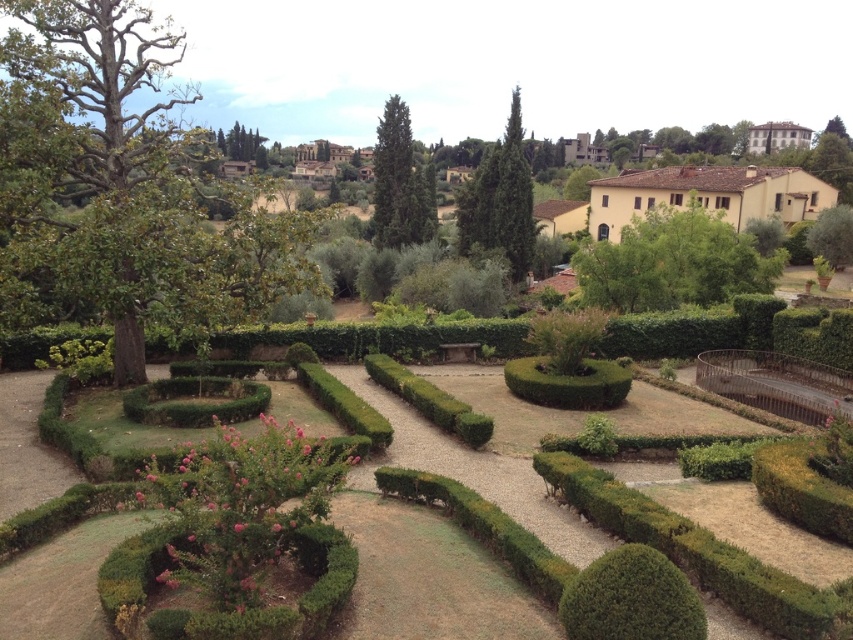
You are standing at the center of the garden and want to locate the green leafy tree at upper center. According to the garden layout, where should you look relative to your current position?

The green leafy tree at upper center is located at point 0.220 on the x axis and 0.797 on the y axis, so you should look to the left and slightly downward from your current position at the center of the garden.

You are a gardener planning to water the green leafy tree at upper center and the green leafy bush at right. Based on their positions, which one do you think is closer to the right edge of the garden?

The green leafy bush at right is closer to the right edge of the garden because the green leafy tree at upper center is positioned to the right of it, meaning the bush is further left compared to the tree.

Consider the image. You are standing at the entrance of the formal garden and want to reach the green leafy bush at lower right. The garden has a strict rule that you must stay on the pathways, which are the curved hedges. Given that the pathways are 3 feet wide, can you walk directly to the bush without stepping off the path?

The green leafy bush at lower right is 44.58 feet away from the camera. Since the pathways are 3 feet wide and you must stay on them, you can walk directly to the bush as long as the path leads to it without requiring you to step off. However, the distance alone doesn